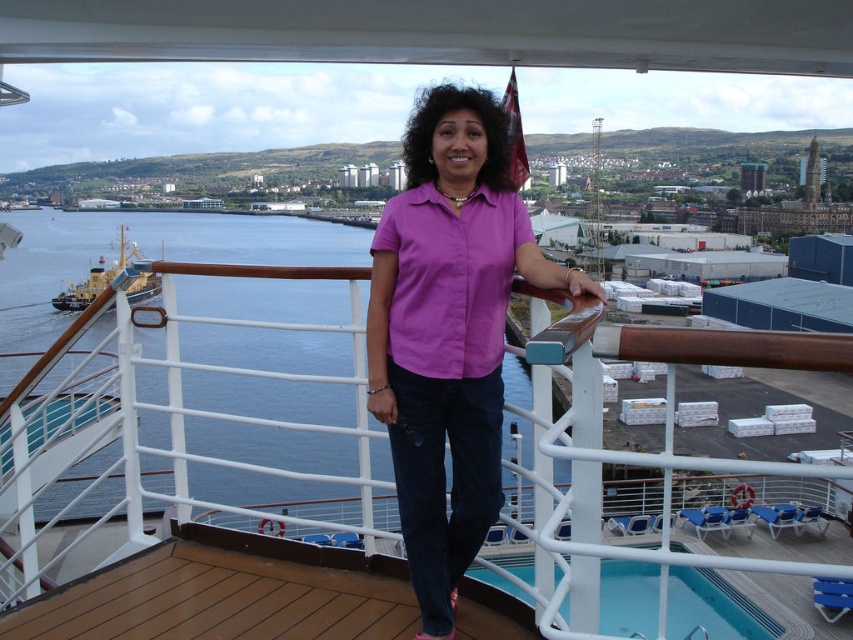
What do you see at coordinates (448, 332) in the screenshot? I see `matte pink shirt at center` at bounding box center [448, 332].

This screenshot has height=640, width=853. In order to click on matte pink shirt at center in this screenshot , I will do `click(448, 332)`.